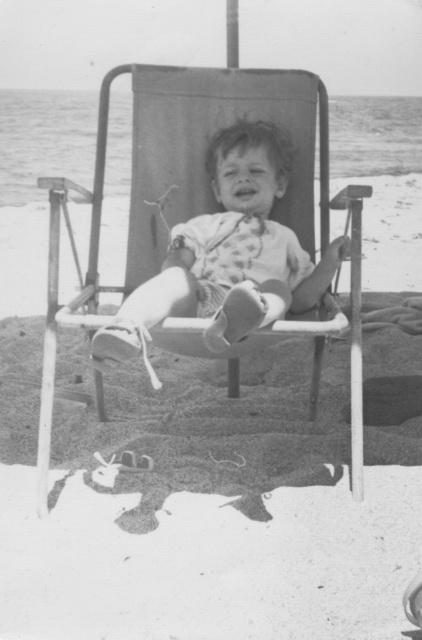
Between point (92, 228) and point (326, 280), which one is positioned in front?

Point (326, 280) is more forward.

In the scene shown: How far apart are metallic fabric beach chair at center and matte white toddler at center?

metallic fabric beach chair at center and matte white toddler at center are 7.50 inches apart from each other.

Image resolution: width=422 pixels, height=640 pixels. In order to click on metallic fabric beach chair at center in this screenshot , I will do pos(197,198).